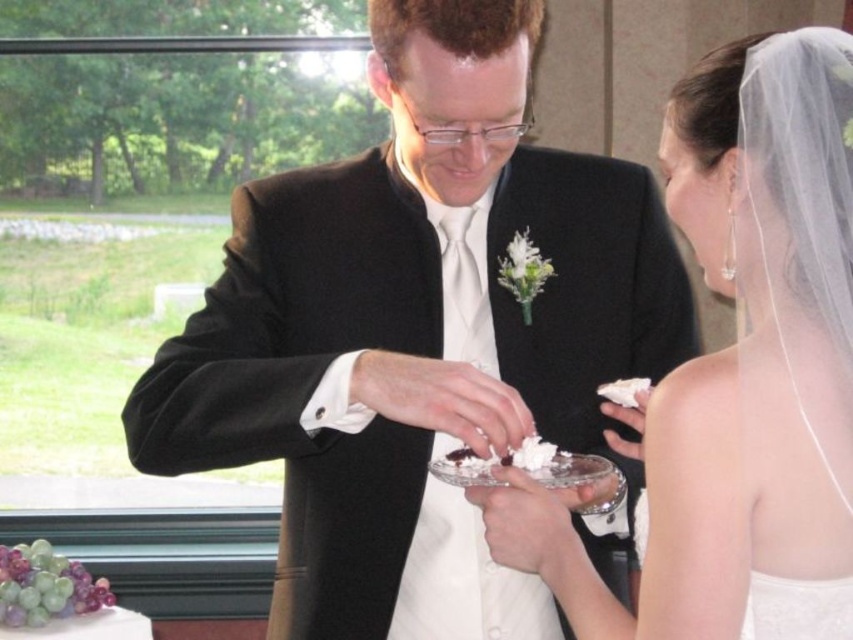
Question: Can you confirm if white satin dress at center is positioned below white fluffy frosting at center?

Choices:
 (A) yes
 (B) no

Answer: (B)

Question: Among these objects, which one is nearest to the camera?

Choices:
 (A) white satin dress at center
 (B) white frosted cake at lower left

Answer: (A)

Question: Based on their relative distances, which object is farther from the white frosted cake at lower left?

Choices:
 (A) white fluffy frosting at center
 (B) black satin suit at center
 (C) white satin dress at center

Answer: (C)

Question: Considering the relative positions of black satin suit at center and white fluffy frosting at center in the image provided, where is black satin suit at center located with respect to white fluffy frosting at center?

Choices:
 (A) above
 (B) below

Answer: (A)

Question: Estimate the real-world distances between objects in this image. Which object is farther from the white satin dress at center?

Choices:
 (A) black satin suit at center
 (B) white frosted cake at lower left

Answer: (B)

Question: Is white frosted cake at lower left behind white fluffy frosting at center?

Choices:
 (A) yes
 (B) no

Answer: (A)